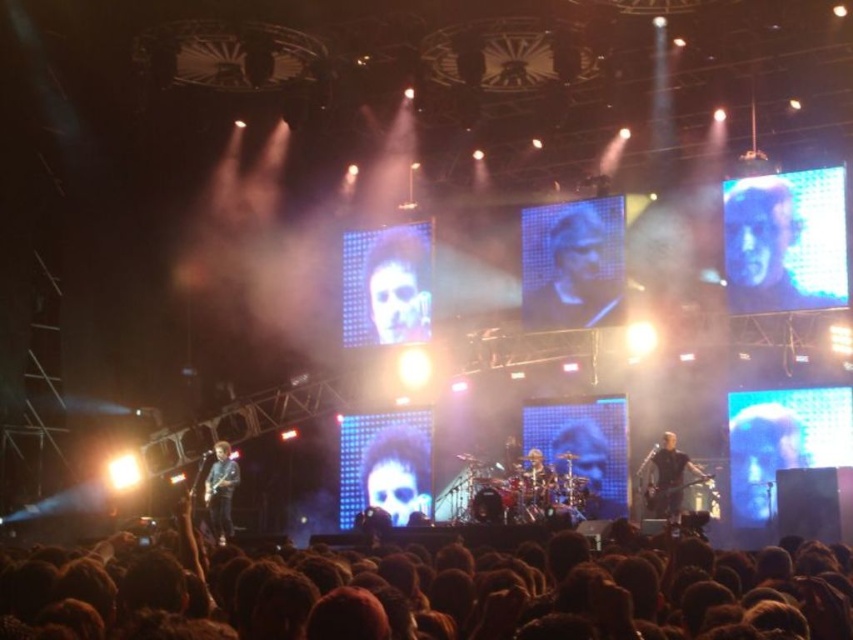
Who is taller, brown hair at lower center or blue glossy face at upper right?

blue glossy face at upper right is taller.

Can you confirm if brown hair at lower center is positioned below blue glossy face at upper right?

Yes, brown hair at lower center is below blue glossy face at upper right.

Which is behind, point (308, 582) or point (729, 264)?

Positioned behind is point (729, 264).

Locate an element on the screen. The width and height of the screenshot is (853, 640). brown hair at lower center is located at coordinates (425, 589).

Can you confirm if blue matte face at center is positioned to the right of blue denim jacket at lower left?

Indeed, blue matte face at center is positioned on the right side of blue denim jacket at lower left.

Between blue matte face at center and blue denim jacket at lower left, which one appears on the right side from the viewer's perspective?

From the viewer's perspective, blue matte face at center appears more on the right side.

What do you see at coordinates (761, 451) in the screenshot?
I see `blue matte face at center` at bounding box center [761, 451].

Where is `blue matte face at center`? blue matte face at center is located at coordinates (761, 451).

In the scene shown: Can you confirm if smooth black face at center is shorter than shiny black hair at center?

In fact, smooth black face at center may be taller than shiny black hair at center.

Is point (598, 308) farther from viewer compared to point (404, 257)?

No.

This screenshot has height=640, width=853. Find the location of `smooth black face at center`. smooth black face at center is located at coordinates (572, 262).

Where is `smooth black face at center`? Image resolution: width=853 pixels, height=640 pixels. smooth black face at center is located at coordinates (572, 262).